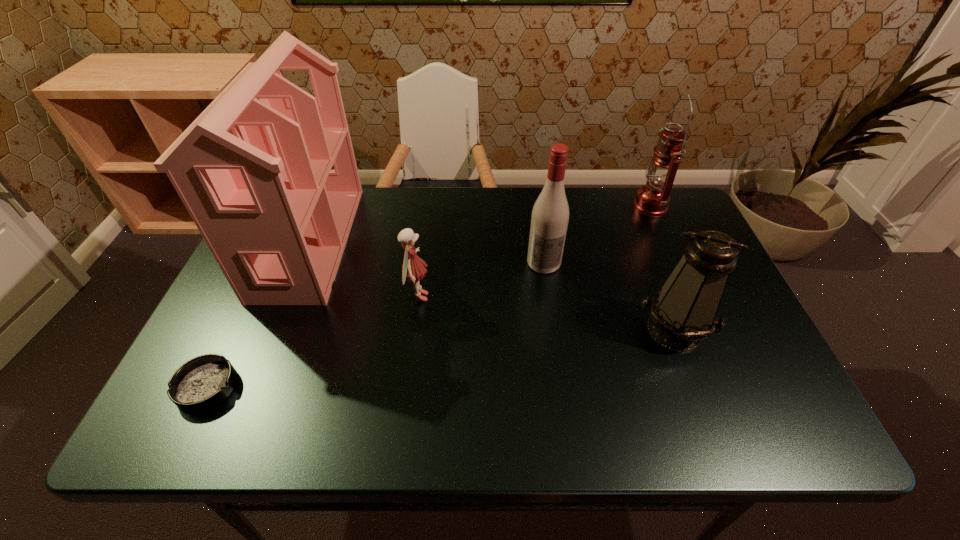
You are a GUI agent. You are given a task and a screenshot of the screen. Output one action in this format:
    pyautogui.click(x=<x>, y=<y>)
    Task: Click on the vacant area in the image that satisfies the following two spatial constraints: 1. on the front-facing side of the fourth object from right to left; 2. on the front side of the nearest object
    
    Given the screenshot: What is the action you would take?
    pyautogui.click(x=406, y=387)

Where is `free region that satisfies the following two spatial constraints: 1. on the front-facing side of the fourth object from right to left; 2. on the right side of the nearer oil lamp`? free region that satisfies the following two spatial constraints: 1. on the front-facing side of the fourth object from right to left; 2. on the right side of the nearer oil lamp is located at coordinates (414, 329).

You are a GUI agent. You are given a task and a screenshot of the screen. Output one action in this format:
    pyautogui.click(x=<x>, y=<y>)
    Task: Click on the free spot that satisfies the following two spatial constraints: 1. on the front-facing side of the tallest object; 2. on the right side of the fourth tallest object
    The height and width of the screenshot is (540, 960).
    Given the screenshot: What is the action you would take?
    pyautogui.click(x=275, y=329)

Locate an element on the screen. This screenshot has height=540, width=960. vacant space that satisfies the following two spatial constraints: 1. on the back side of the fourth tallest object; 2. on the front-facing side of the doll is located at coordinates (660, 296).

This screenshot has height=540, width=960. I want to click on free point that satisfies the following two spatial constraints: 1. on the label of the alcohol; 2. on the front-facing side of the doll, so click(x=549, y=296).

This screenshot has width=960, height=540. Identify the location of vacant space that satisfies the following two spatial constraints: 1. on the front-facing side of the dollhouse; 2. on the back side of the nearer oil lamp. (275, 329).

The height and width of the screenshot is (540, 960). Find the location of `vacant point that satisfies the following two spatial constraints: 1. on the front-facing side of the tallest object; 2. on the back side of the nearer oil lamp`. vacant point that satisfies the following two spatial constraints: 1. on the front-facing side of the tallest object; 2. on the back side of the nearer oil lamp is located at coordinates (275, 329).